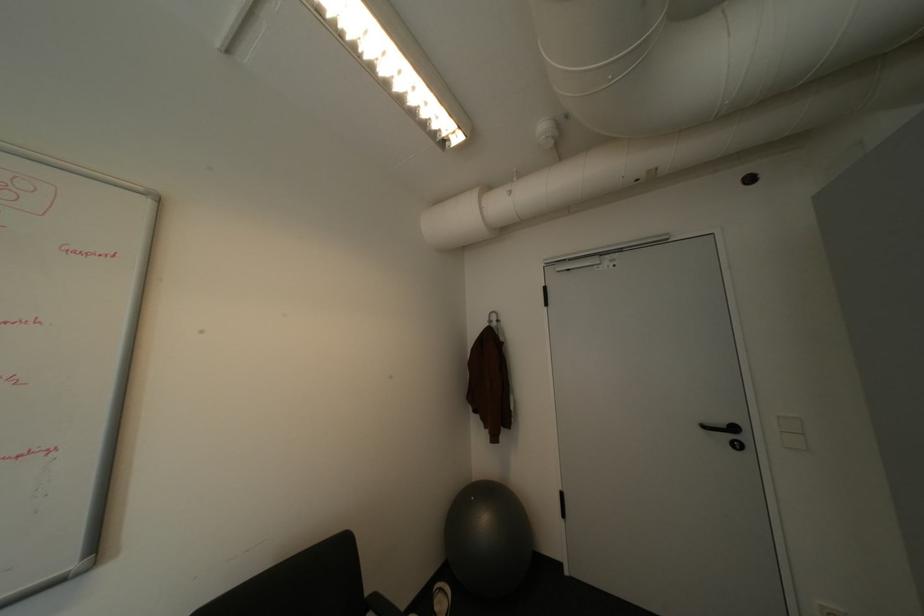
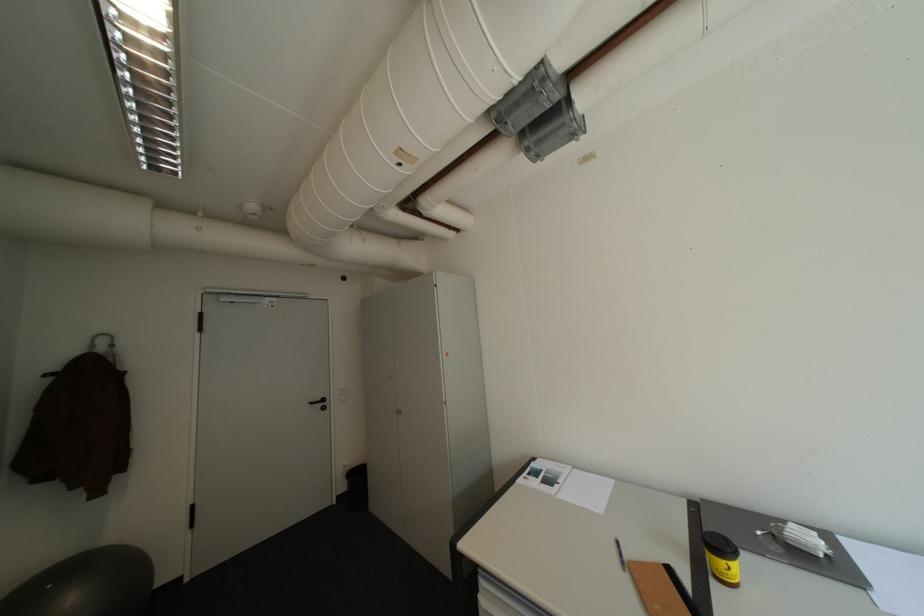
The point at (482, 498) is marked in the first image. Where is the corresponding point in the second image?

(59, 586)